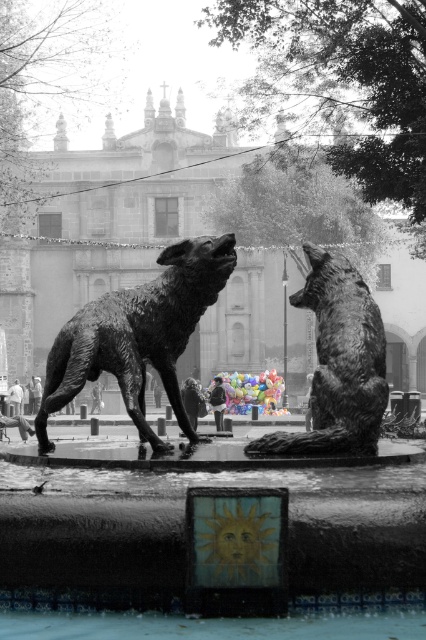
Question: Can you confirm if bronze statue at center is positioned below bronze statue of a howling dog at center?

Choices:
 (A) yes
 (B) no

Answer: (A)

Question: Estimate the real-world distances between objects in this image. Which object is closer to the bronze wolf at center?

Choices:
 (A) bronze statue at center
 (B) bronze statue of a howling dog at center

Answer: (B)

Question: Observing the image, what is the correct spatial positioning of bronze statue of a howling dog at center in reference to bronze wolf at center?

Choices:
 (A) below
 (B) above

Answer: (B)

Question: Does bronze statue at center have a smaller size compared to bronze statue of a howling dog at center?

Choices:
 (A) no
 (B) yes

Answer: (A)

Question: Which point is farther from the camera taking this photo?

Choices:
 (A) click(345, 493)
 (B) click(357, 317)
 (C) click(141, 358)

Answer: (C)

Question: Which of the following is the farthest from the observer?

Choices:
 (A) bronze statue at center
 (B) bronze statue of a howling dog at center
 (C) bronze wolf at center

Answer: (B)